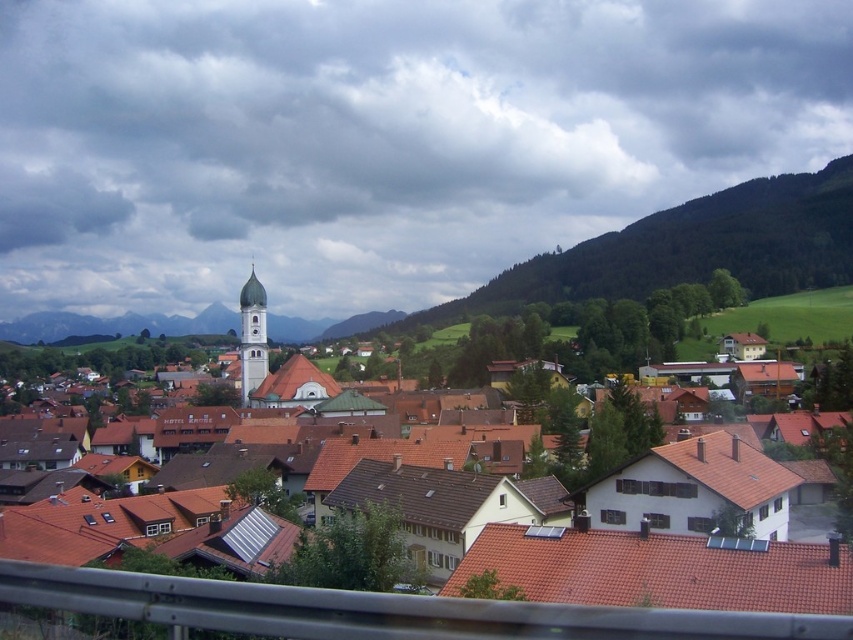
Describe the element at coordinates (384, 611) in the screenshot. This screenshot has width=853, height=640. I see `brown tiled roofs at center` at that location.

Who is lower down, brown tiled roofs at center or green forested mountain at upper center?

Positioned lower is brown tiled roofs at center.

The height and width of the screenshot is (640, 853). Find the location of `brown tiled roofs at center`. brown tiled roofs at center is located at coordinates (384, 611).

Between point (619, 289) and point (247, 307), which one is positioned in front?

Positioned in front is point (247, 307).

Does green forested mountain at upper center appear on the right side of light gray stone bell tower at center?

Yes, green forested mountain at upper center is to the right of light gray stone bell tower at center.

Identify the location of green forested mountain at upper center. This screenshot has width=853, height=640. (676, 252).

The height and width of the screenshot is (640, 853). I want to click on green forested mountain at upper center, so click(x=676, y=252).

Is the position of brown tiled roofs at center less distant than that of light gray stone bell tower at center?

Yes.

Who is more forward, (660, 611) or (247, 400)?

Positioned in front is point (660, 611).

Is point (766, 630) positioned before point (252, 269)?

Yes.

The width and height of the screenshot is (853, 640). Find the location of `brown tiled roofs at center`. brown tiled roofs at center is located at coordinates (384, 611).